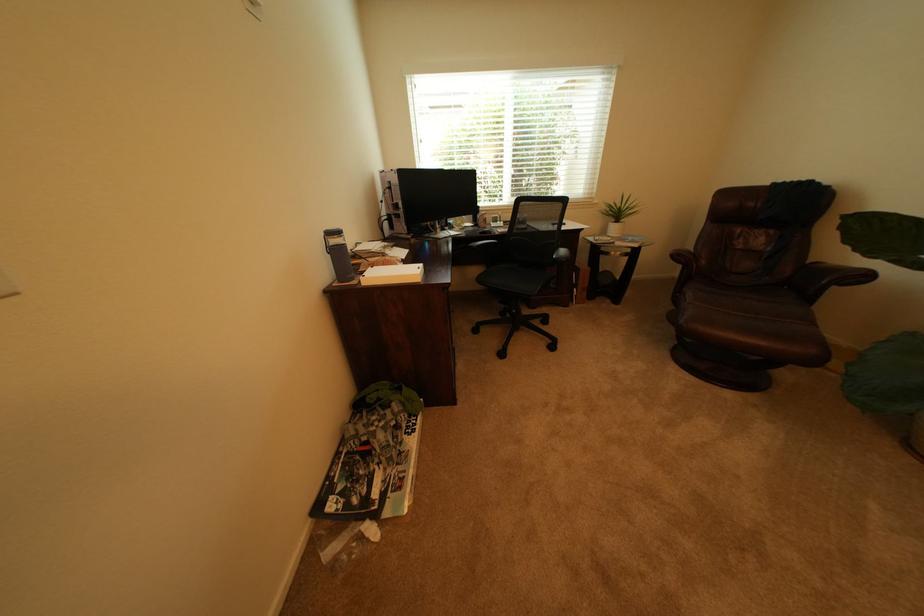
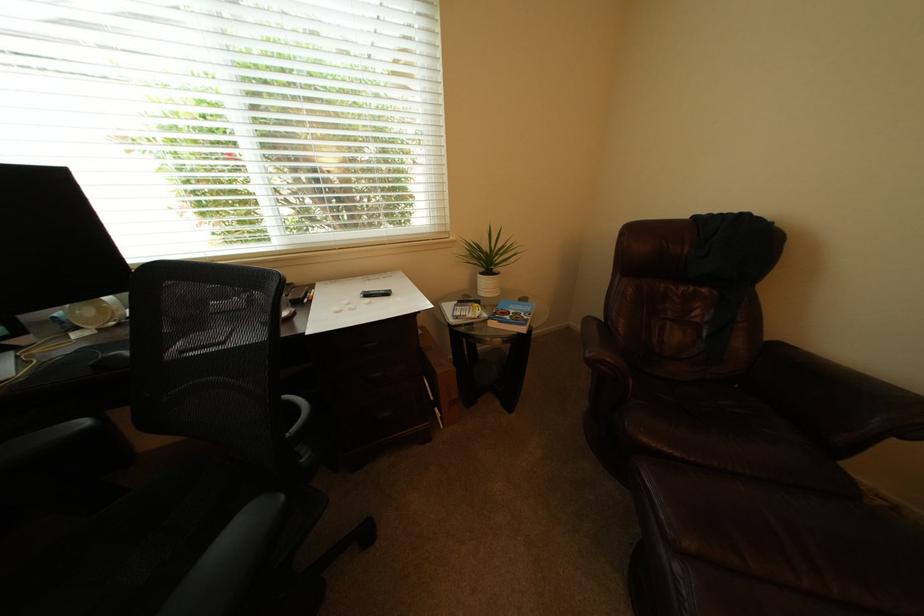
The images are taken continuously from a first-person perspective. In which direction are you moving?

The movement direction of the cameraman is right, forward.